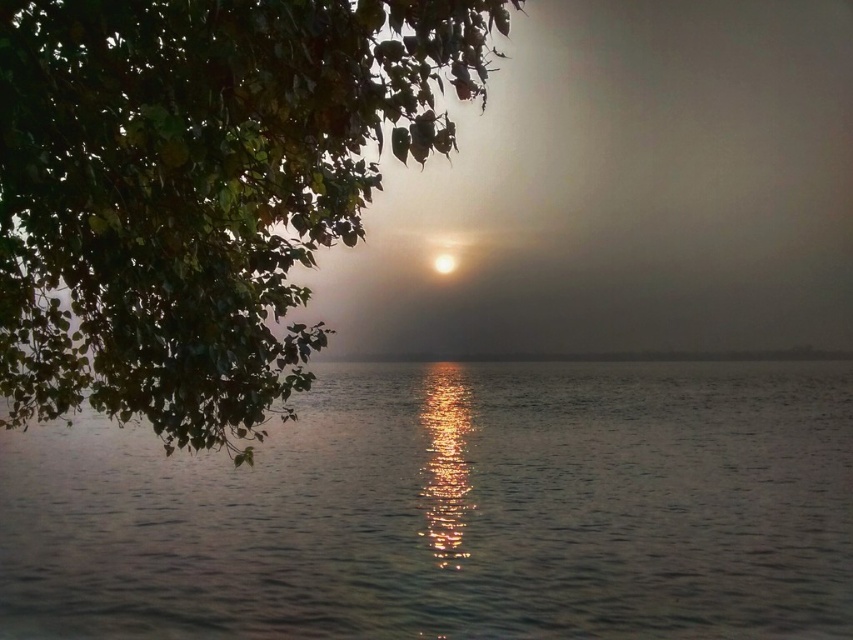
You are observing the sunset scene and notice the green leafy tree at upper left. Can you determine its position relative to the center of the image?

The green leafy tree at upper left is located at point coordinates approximately 0.298 on the horizontal axis and 0.237 on the vertical axis, which places it in the upper left quadrant of the image.

You are standing at the point with coordinates point (445, 38) and want to walk to the point with coordinates point (448, 272). Based on the scene description, will you have an unobstructed path to walk directly towards your destination?

Since point (445, 38) is in front of point (448, 272), you will not have an unobstructed path to walk directly towards your destination because the closer point is blocking the path.

You are an astronomer observing the sunset. You notice the glistening silver water at center and the bright white orb at center. According to the scene, where is the glistening silver water in relation to the bright white orb?

The glistening silver water at center is located below the bright white orb at center.